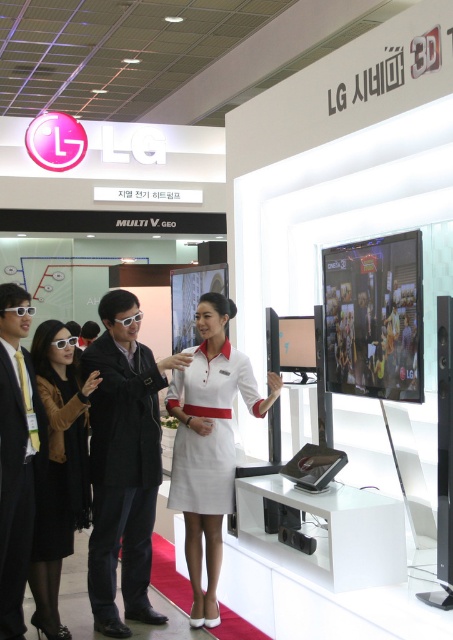
Question: Among these objects, which one is nearest to the camera?

Choices:
 (A) white fabric dress at center
 (B) black matte suit at center
 (C) white glossy sunglasses at left
 (D) black fabric dress at center

Answer: (C)

Question: Is white fabric dress at center below black fabric dress at center?

Choices:
 (A) no
 (B) yes

Answer: (A)

Question: Is black matte suit at center positioned at the back of white fabric dress at center?

Choices:
 (A) yes
 (B) no

Answer: (B)

Question: Among these points, which one is farthest from the camera?

Choices:
 (A) click(172, 481)
 (B) click(130, 524)

Answer: (A)

Question: Which object is the farthest from the black fabric dress at center?

Choices:
 (A) black matte suit at center
 (B) white glossy sunglasses at left

Answer: (A)

Question: Does black matte suit at center appear on the right side of white fabric dress at center?

Choices:
 (A) no
 (B) yes

Answer: (A)